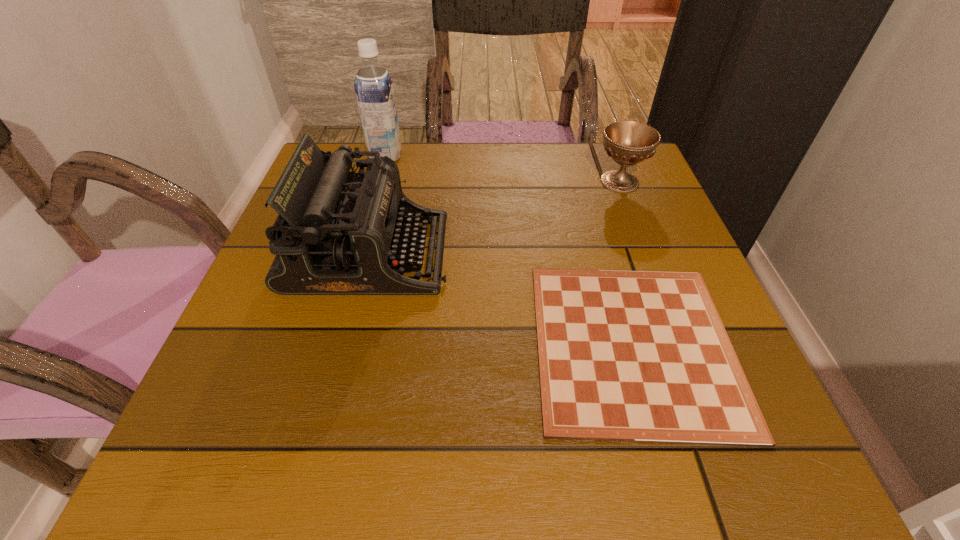
Where is `empty space that is in between the tallest object and the shortest object`? The image size is (960, 540). empty space that is in between the tallest object and the shortest object is located at coordinates (510, 250).

Identify the location of vacant space that's between the farthest object and the third nearest object. Image resolution: width=960 pixels, height=540 pixels. (503, 169).

Where is `free space that is in between the checkerboard and the tallest object`? This screenshot has height=540, width=960. free space that is in between the checkerboard and the tallest object is located at coordinates (510, 250).

I want to click on vacant point located between the third tallest object and the tallest object, so click(x=503, y=169).

At what (x,y) coordinates should I click in order to perform the action: click on object that can be found as the closest to the checkerboard. Please return your answer as a coordinate pair (x, y). Looking at the image, I should click on (338, 232).

Locate an element on the screen. Image resolution: width=960 pixels, height=540 pixels. object that can be found as the second closest to the second shortest object is located at coordinates (338, 232).

Where is `blank space that satisfies the following two spatial constraints: 1. on the front side of the chalice; 2. on the keyboard of the second tallest object`? blank space that satisfies the following two spatial constraints: 1. on the front side of the chalice; 2. on the keyboard of the second tallest object is located at coordinates (647, 253).

This screenshot has width=960, height=540. What are the coordinates of `vacant space that satisfies the following two spatial constraints: 1. on the keyboard of the shortest object; 2. on the right side of the second tallest object` in the screenshot? It's located at (345, 345).

Find the location of a particular element. This screenshot has width=960, height=540. vacant region that satisfies the following two spatial constraints: 1. on the back side of the second shortest object; 2. on the right side of the shortest object is located at coordinates (586, 181).

Where is `free space that satisfies the following two spatial constraints: 1. on the label of the farthest object; 2. on the right side of the chalice`? The width and height of the screenshot is (960, 540). free space that satisfies the following two spatial constraints: 1. on the label of the farthest object; 2. on the right side of the chalice is located at coordinates point(378,181).